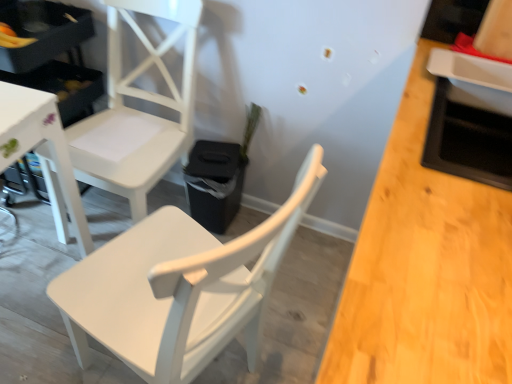
Question: From the image's perspective, is white matte chair at upper left, the second chair in the front-to-back sequence, over white matte chair at center, the second chair when ordered from back to front?

Choices:
 (A) yes
 (B) no

Answer: (A)

Question: From a real-world perspective, is white matte chair at upper left, which ranks as the 1th chair in back-to-front order, positioned over white matte chair at center, the 1th chair viewed from the front, based on gravity?

Choices:
 (A) yes
 (B) no

Answer: (B)

Question: Considering the relative positions of white matte chair at upper left, which ranks as the 1th chair in back-to-front order, and white matte chair at center, the second chair when ordered from back to front, in the image provided, is white matte chair at upper left, which ranks as the 1th chair in back-to-front order, to the right of white matte chair at center, the second chair when ordered from back to front, from the viewer's perspective?

Choices:
 (A) no
 (B) yes

Answer: (A)

Question: Does white matte chair at upper left, which ranks as the 1th chair in back-to-front order, have a lesser height compared to white matte chair at center, the 1th chair viewed from the front?

Choices:
 (A) no
 (B) yes

Answer: (A)

Question: Is the depth of white matte chair at upper left, which ranks as the 1th chair in back-to-front order, greater than that of white matte chair at center, the second chair when ordered from back to front?

Choices:
 (A) yes
 (B) no

Answer: (A)

Question: Could white matte chair at center, the 1th chair viewed from the front, be considered to be inside white matte chair at upper left, which ranks as the 1th chair in back-to-front order?

Choices:
 (A) no
 (B) yes

Answer: (A)

Question: From the image's perspective, is white matte chair at center, the second chair when ordered from back to front, located above white matte chair at upper left, which ranks as the 1th chair in back-to-front order?

Choices:
 (A) no
 (B) yes

Answer: (A)

Question: Is white matte chair at center, the second chair when ordered from back to front, in front of white matte chair at upper left, which ranks as the 1th chair in back-to-front order?

Choices:
 (A) no
 (B) yes

Answer: (B)

Question: Is the depth of white matte chair at center, the 1th chair viewed from the front, greater than that of white matte chair at upper left, the second chair in the front-to-back sequence?

Choices:
 (A) no
 (B) yes

Answer: (A)

Question: Can you confirm if white matte chair at center, the 1th chair viewed from the front, is wider than white matte chair at upper left, which ranks as the 1th chair in back-to-front order?

Choices:
 (A) yes
 (B) no

Answer: (A)

Question: Is white matte chair at center, the second chair when ordered from back to front, facing away from white matte chair at upper left, the second chair in the front-to-back sequence?

Choices:
 (A) no
 (B) yes

Answer: (A)

Question: From a real-world perspective, is white matte chair at center, the second chair when ordered from back to front, physically above white matte chair at upper left, the second chair in the front-to-back sequence?

Choices:
 (A) no
 (B) yes

Answer: (B)

Question: Is white matte chair at center, the 1th chair viewed from the front, to the left or to the right of white matte chair at upper left, which ranks as the 1th chair in back-to-front order, in the image?

Choices:
 (A) left
 (B) right

Answer: (B)